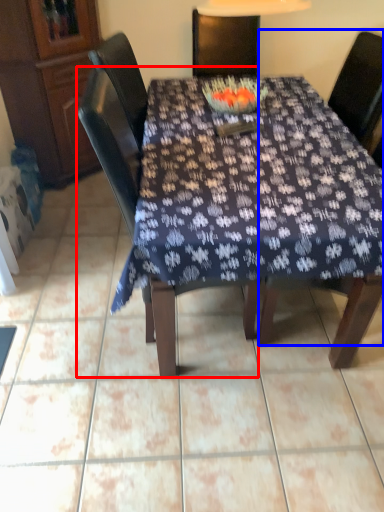
Question: Which object appears farthest to the camera in this image, chair (highlighted by a red box) or chair (highlighted by a blue box)?

Choices:
 (A) chair
 (B) chair

Answer: (B)